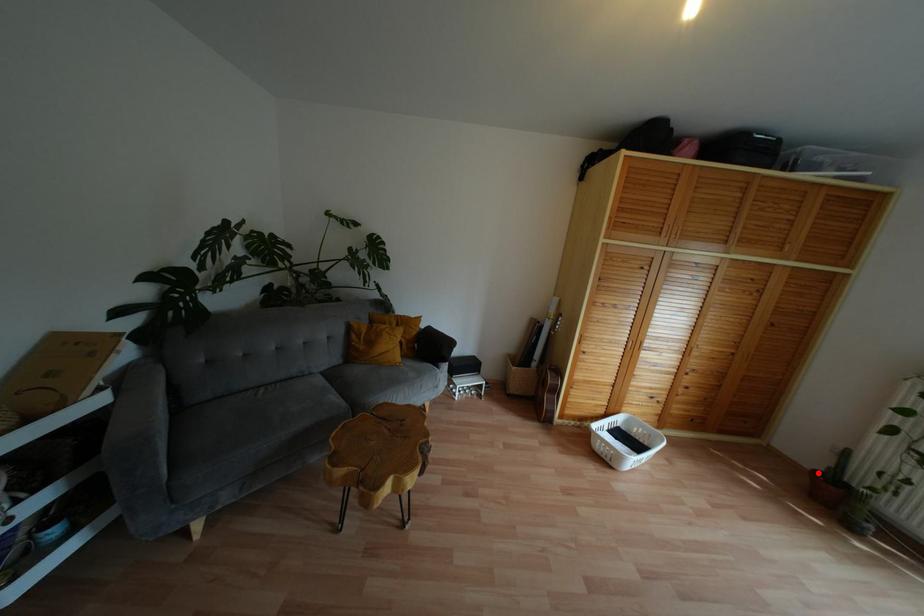
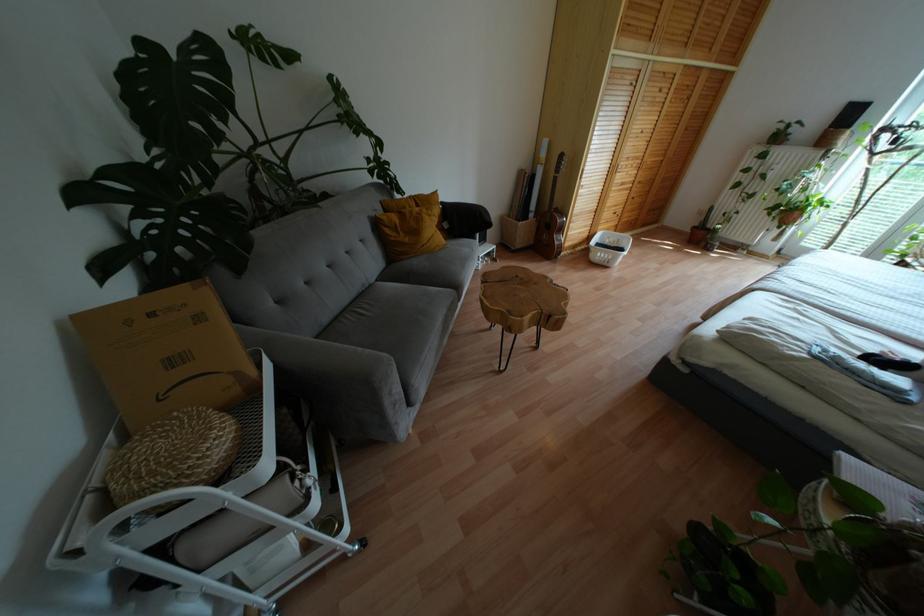
Question: A red point is marked in image1. In image2, is the corresponding 3D point closer to the camera or farther? Reply with the corresponding letter.

Choices:
 (A) The corresponding 3D point is closer.
 (B) The corresponding 3D point is farther.

Answer: (A)